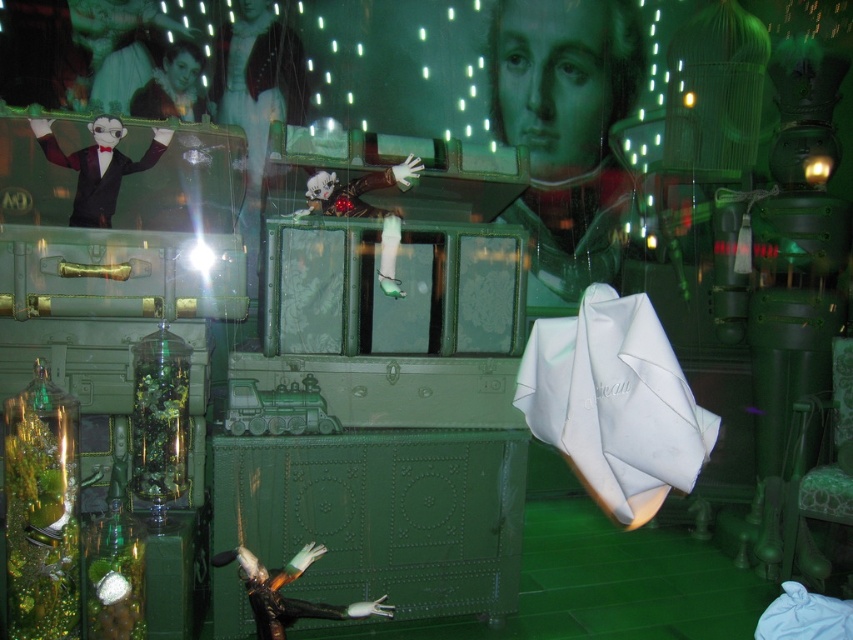
Question: Which object appears farthest from the camera in this image?

Choices:
 (A) smooth green portrait at upper center
 (B) matte black suit at upper left
 (C) white satin umbrella at center right

Answer: (A)

Question: Estimate the real-world distances between objects in this image. Which object is closer to the white satin umbrella at center right?

Choices:
 (A) smooth green portrait at upper center
 (B) matte black suit at upper left
 (C) shiny silver figurine at center

Answer: (C)

Question: Is white satin umbrella at center right thinner than matte black suit at upper left?

Choices:
 (A) no
 (B) yes

Answer: (A)

Question: Can you confirm if white satin umbrella at center right is positioned below shiny silver figurine at center?

Choices:
 (A) yes
 (B) no

Answer: (B)

Question: Is white satin umbrella at center right further to camera compared to shiny silver figurine at center?

Choices:
 (A) no
 (B) yes

Answer: (A)

Question: Which object is farther from the camera taking this photo?

Choices:
 (A) shiny silver figurine at center
 (B) white satin umbrella at center right
 (C) matte black suit at upper left
 (D) smooth green portrait at upper center

Answer: (D)